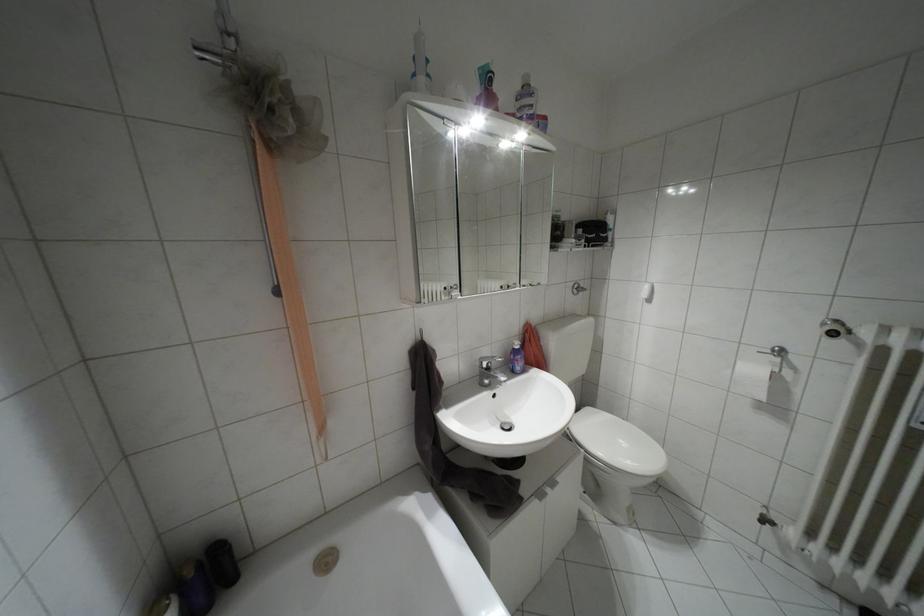
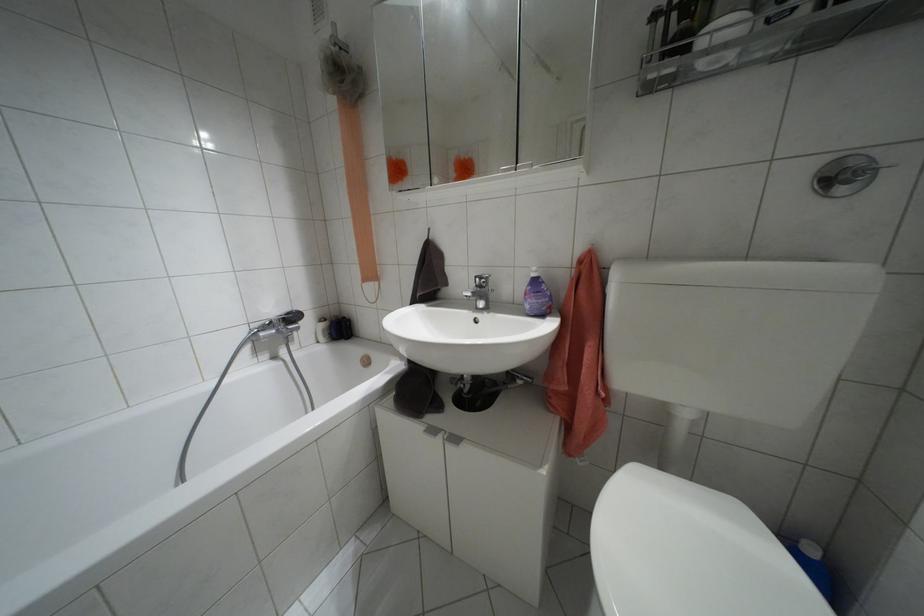
The point at (488, 368) is marked in the first image. Where is the corresponding point in the second image?

(479, 286)